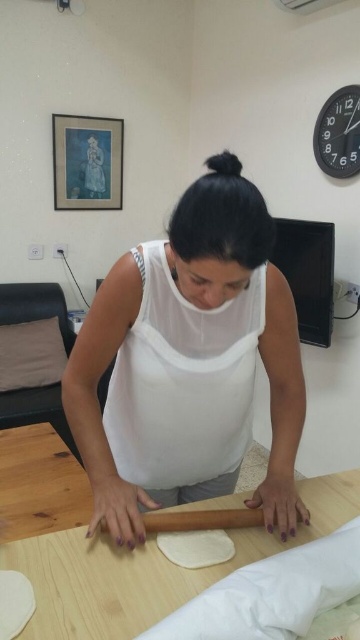
How distant is wooden rolling pin at center from white dough at center?

wooden rolling pin at center and white dough at center are 1.51 inches apart from each other.

Who is positioned more to the right, wooden rolling pin at center or white dough at center?

white dough at center

Find the location of a particular element. wooden rolling pin at center is located at coordinates (201, 518).

This screenshot has width=360, height=640. In order to click on wooden rolling pin at center in this screenshot , I will do `click(201, 518)`.

Does white matte tank top at center have a lesser width compared to wooden table at center?

Correct, white matte tank top at center's width is less than wooden table at center's.

What do you see at coordinates (190, 364) in the screenshot? I see `white matte tank top at center` at bounding box center [190, 364].

The width and height of the screenshot is (360, 640). I want to click on white matte tank top at center, so click(190, 364).

Which is below, white fabric apron at center or wooden rolling pin at center?

wooden rolling pin at center is below.

In order to click on white fabric apron at center in this screenshot , I will do `click(182, 381)`.

What do you see at coordinates (182, 381) in the screenshot? I see `white fabric apron at center` at bounding box center [182, 381].

The image size is (360, 640). I want to click on white fabric apron at center, so click(x=182, y=381).